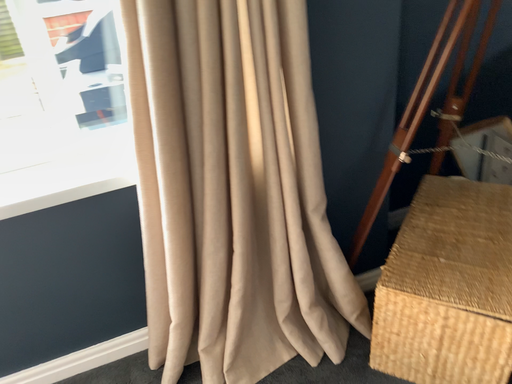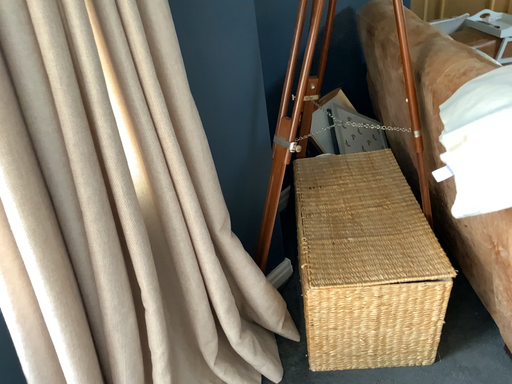
Question: How did the camera likely rotate when shooting the video?

Choices:
 (A) rotated left
 (B) rotated right

Answer: (B)